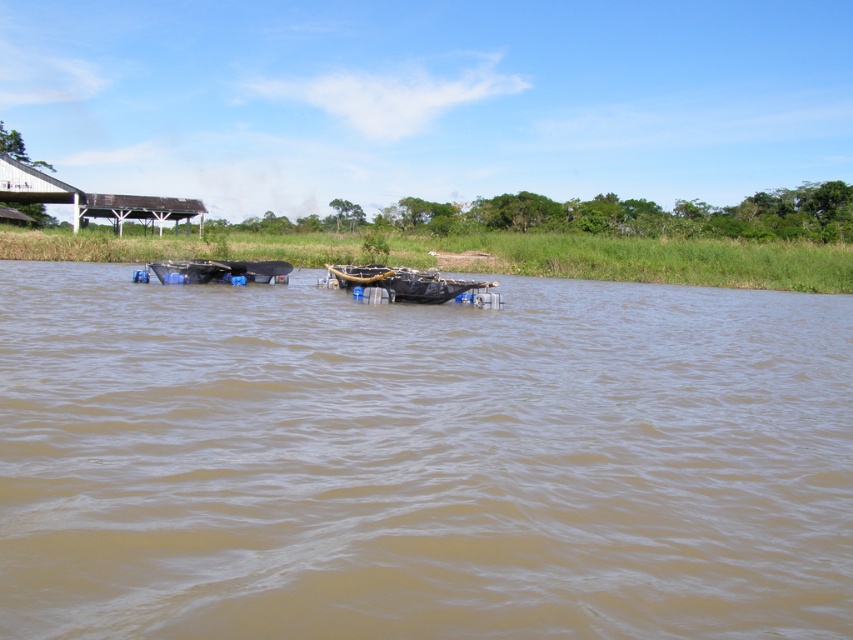
You are a photographer planning to take a wide shot of the scene. You want to ensure both the brown muddy water at center and the dark brown wooden boat at center are fully visible in the frame. Given their sizes, which one will occupy more space in the photo?

The brown muddy water at center will occupy more space in the photo because its width is larger than that of the dark brown wooden boat at center.

You are a fisherman standing on the wooden boat at center. You want to cast your net into the brown muddy water at center. Is the water wide enough for you to cast your net without the boat drifting into the riverbank?

The brown muddy water at center might be wider than wooden boat at center, so there is a possibility that the water is wide enough for casting the net without drifting into the riverbank. However, the exact width is uncertain based on the given information.